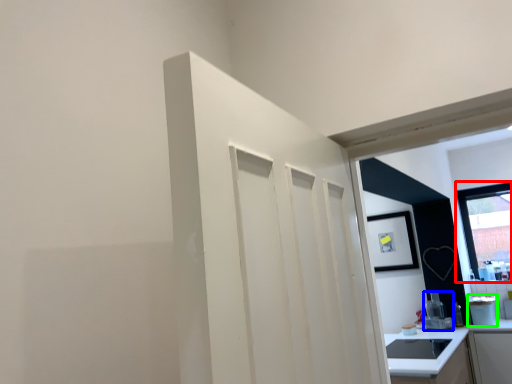
Question: Estimate the real-world distances between objects in this image. Which object is closer to window (highlighted by a red box), appliance (highlighted by a blue box) or appliance (highlighted by a green box)?

Choices:
 (A) appliance
 (B) appliance

Answer: (B)